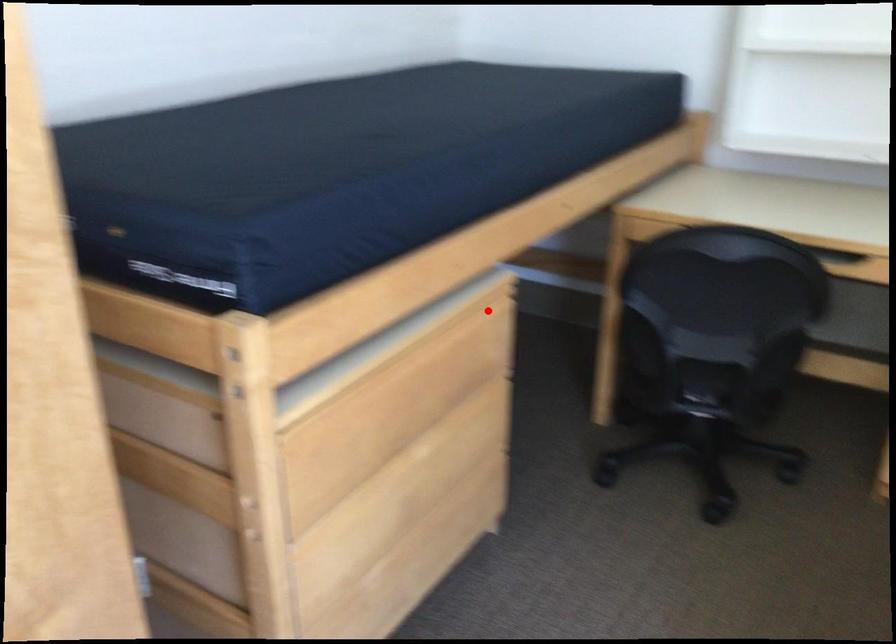
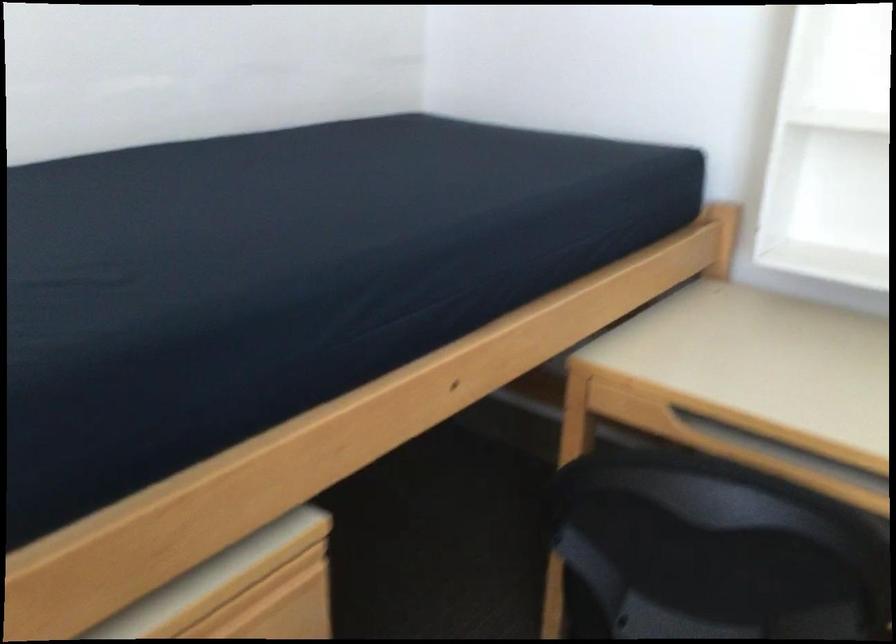
Question: I am providing you with two images of the same scene from different viewpoints. A red point is shown in image1. For the corresponding object point in image2, is it positioned nearer or farther from the camera?

Choices:
 (A) Nearer
 (B) Farther

Answer: (A)